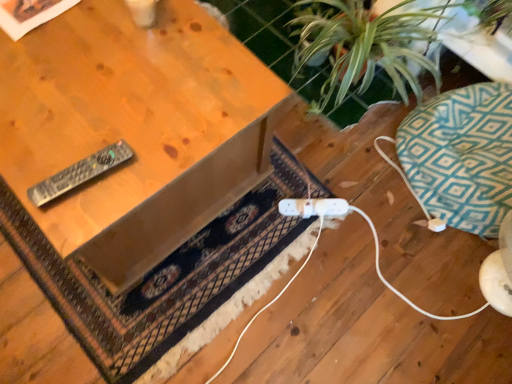
The width and height of the screenshot is (512, 384). I want to click on free spot in front of black plastic remote at left, so click(74, 214).